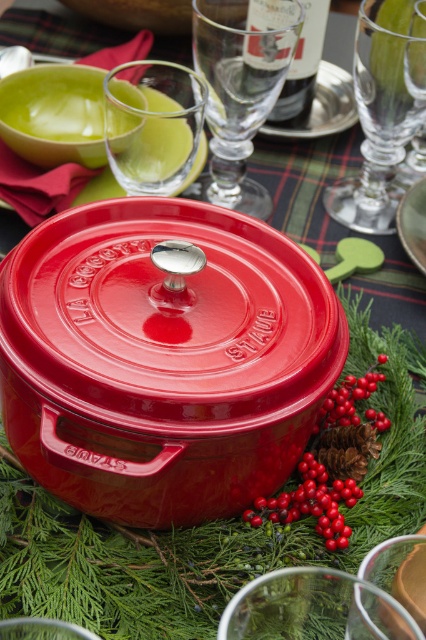
Question: Among these objects, which one is farthest from the camera?

Choices:
 (A) transparent glass at upper center
 (B) glossy red berries at center

Answer: (A)

Question: Is transparent glass at upper center above glossy red berries at center?

Choices:
 (A) yes
 (B) no

Answer: (A)

Question: Is transparent glass wine glass at upper right wider than transparent glass at upper right?

Choices:
 (A) yes
 (B) no

Answer: (A)

Question: Which of the following is the closest to the observer?

Choices:
 (A) transparent glass at upper right
 (B) transparent glass wine glass at upper right
 (C) dark glass bottle at upper center
 (D) glossy red berry at lower right

Answer: (D)

Question: Does dark glass bottle at upper center have a smaller size compared to glossy red berry at lower right?

Choices:
 (A) yes
 (B) no

Answer: (B)

Question: Considering the real-world distances, which object is closest to the transparent glass at upper right?

Choices:
 (A) transparent glass wine glass at upper center
 (B) glossy red berry at lower right

Answer: (A)